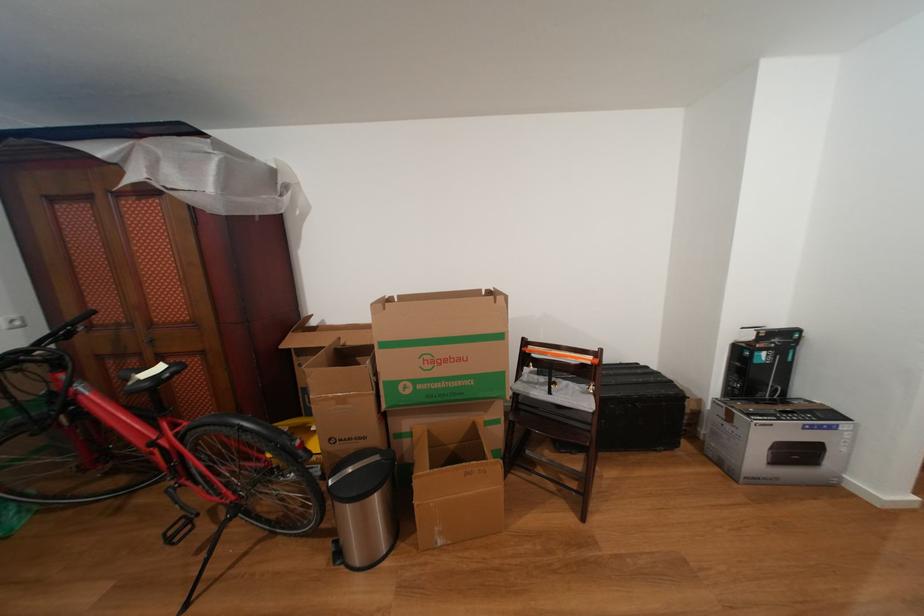
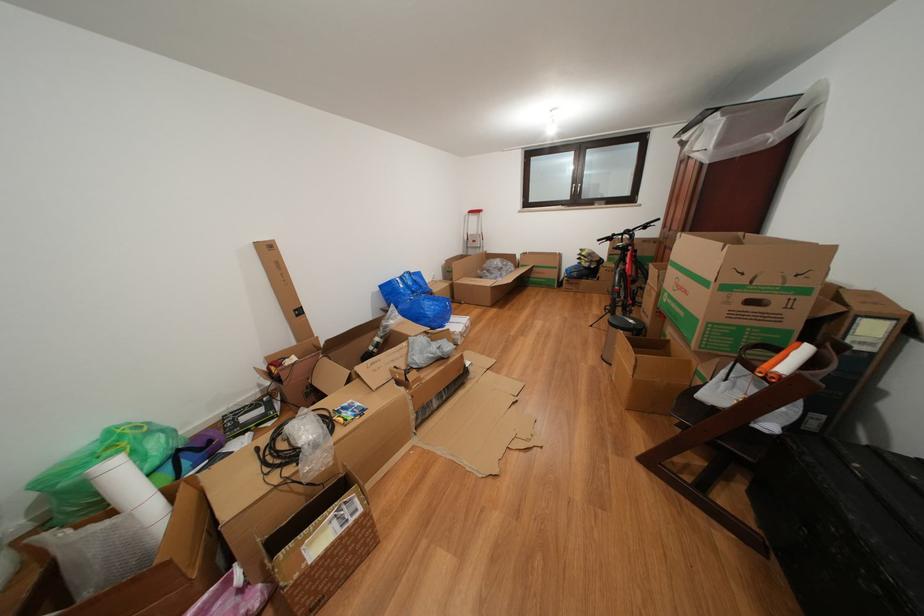
Find the pixel in the second image that matches (468,365) in the first image.

(694, 297)